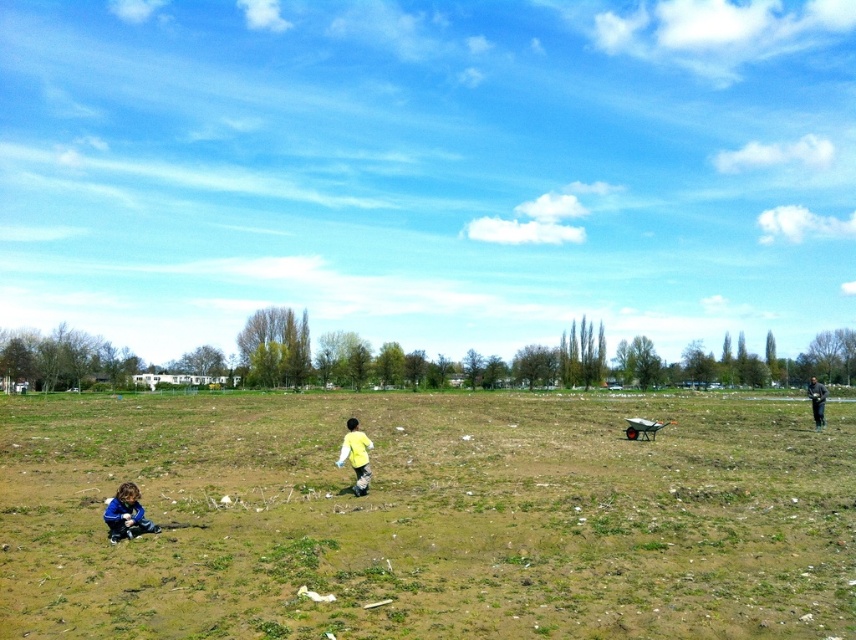
Does green grass at center appear on the left side of dark gray fabric at right?

Yes, green grass at center is to the left of dark gray fabric at right.

Between green grass at center and dark gray fabric at right, which one appears on the right side from the viewer's perspective?

Positioned to the right is dark gray fabric at right.

You are a GUI agent. You are given a task and a screenshot of the screen. Output one action in this format:
    pyautogui.click(x=<x>, y=<y>)
    Task: Click on the green grass at center
    The width and height of the screenshot is (856, 640).
    Given the screenshot: What is the action you would take?
    pyautogui.click(x=428, y=516)

Between blue fleece jacket at lower left and dark gray fabric at right, which one has more height?

Standing taller between the two is dark gray fabric at right.

At what (x,y) coordinates should I click in order to perform the action: click on blue fleece jacket at lower left. Please return your answer as a coordinate pair (x, y). The image size is (856, 640). Looking at the image, I should click on (126, 513).

You are a GUI agent. You are given a task and a screenshot of the screen. Output one action in this format:
    pyautogui.click(x=<x>, y=<y>)
    Task: Click on the blue fleece jacket at lower left
    
    Given the screenshot: What is the action you would take?
    pyautogui.click(x=126, y=513)

Who is taller, green grass at center or blue fleece jacket at lower left?

green grass at center is taller.

Between green grass at center and blue fleece jacket at lower left, which one appears on the left side from the viewer's perspective?

From the viewer's perspective, blue fleece jacket at lower left appears more on the left side.

Which is in front, point (840, 467) or point (128, 506)?

Point (128, 506) is more forward.

This screenshot has height=640, width=856. Find the location of `green grass at center`. green grass at center is located at coordinates (428, 516).